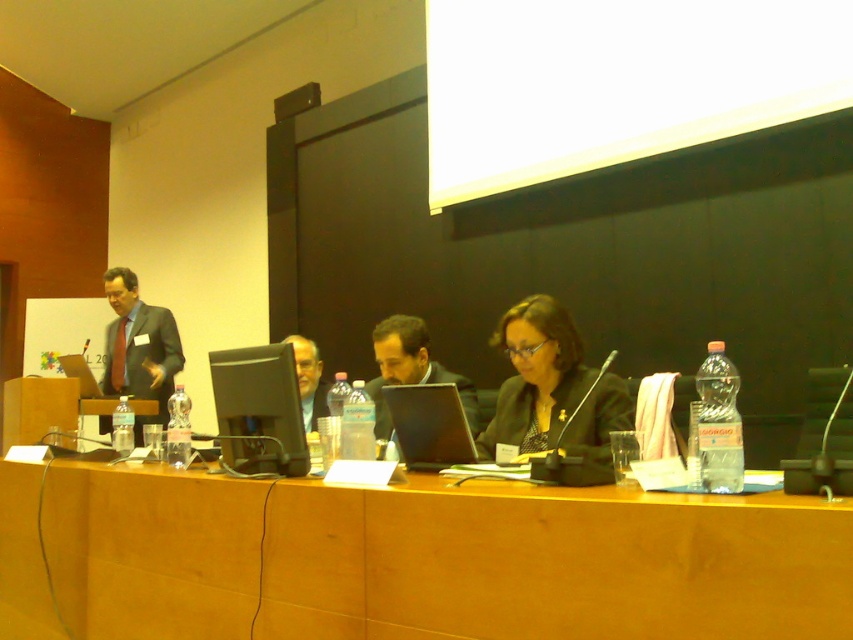
Does matte black jacket at center have a lesser width compared to black plastic laptop at center?

Incorrect, matte black jacket at center's width is not less than black plastic laptop at center's.

Does matte black jacket at center appear under black plastic laptop at center?

Yes, matte black jacket at center is below black plastic laptop at center.

Where is `matte black jacket at center`? The width and height of the screenshot is (853, 640). matte black jacket at center is located at coordinates (550, 387).

Between matte black jacket at center and matte black suit at left, which one appears on the right side from the viewer's perspective?

Positioned to the right is matte black jacket at center.

Which is behind, point (494, 429) or point (170, 321)?

Point (170, 321)

Image resolution: width=853 pixels, height=640 pixels. Find the location of `matte black jacket at center`. matte black jacket at center is located at coordinates (x=550, y=387).

Is black plastic laptop at center shorter than matte black laptop at left?

Yes, black plastic laptop at center is shorter than matte black laptop at left.

Measure the distance between point (398, 394) and camera.

2.17 meters

The height and width of the screenshot is (640, 853). I want to click on black plastic laptop at center, so click(428, 426).